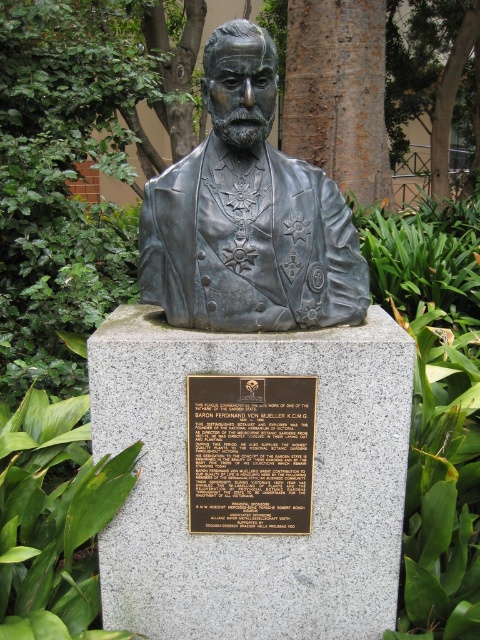
Is point (262, 468) closer to viewer compared to point (356, 60)?

Yes, point (262, 468) is in front of point (356, 60).

Does bronze plaque at center have a larger size compared to brown rough bark tree at center?

Actually, bronze plaque at center might be smaller than brown rough bark tree at center.

Is point (288, 422) positioned in front of point (349, 189)?

Yes.

In order to click on bronze plaque at center in this screenshot , I will do `click(250, 452)`.

What do you see at coordinates (252, 392) in the screenshot? I see `bronze bust at center` at bounding box center [252, 392].

Between bronze bust at center and brown rough bark tree at center, which one is positioned lower?

bronze bust at center is below.

Locate an element on the screen. This screenshot has height=640, width=480. bronze bust at center is located at coordinates (252, 392).

Does bronze bust at center have a smaller size compared to bronze plaque at center?

Incorrect, bronze bust at center is not smaller in size than bronze plaque at center.

At what (x,y) coordinates should I click in order to perform the action: click on bronze bust at center. Please return your answer as a coordinate pair (x, y). Looking at the image, I should click on (252, 392).